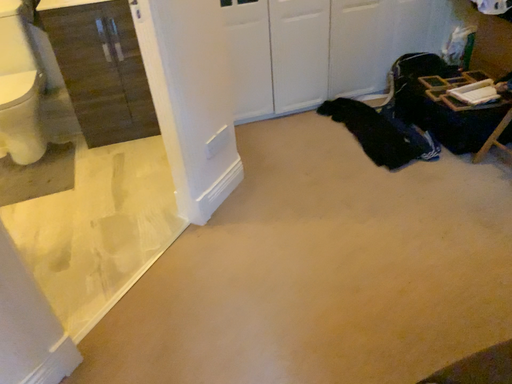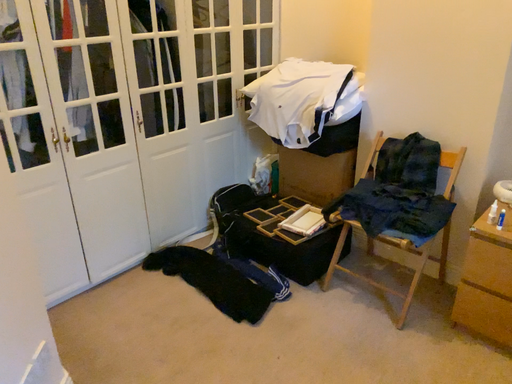
Question: Which way did the camera rotate in the video?

Choices:
 (A) rotated right
 (B) rotated left

Answer: (A)